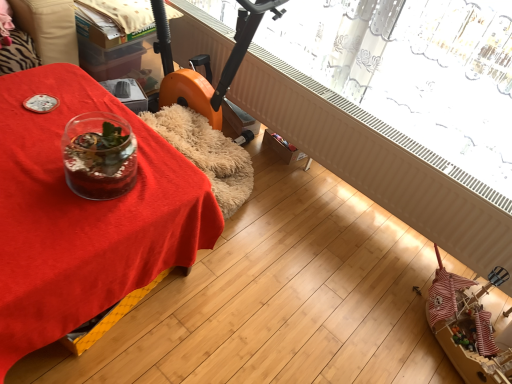
This screenshot has height=384, width=512. In order to click on free point above transparent glass vase at left (from a real-world perspective) in this screenshot , I will do `click(51, 169)`.